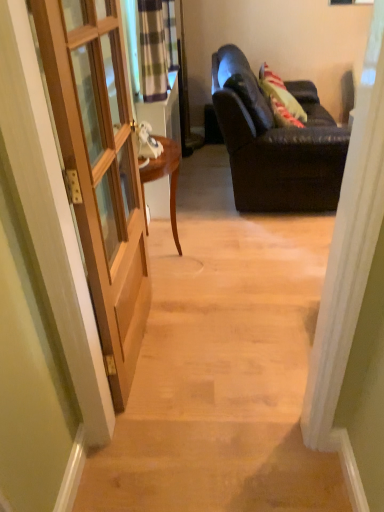
At what (x,y) coordinates should I click in order to perform the action: click on wooden door at left. Please return your answer as a coordinate pair (x, y). Image resolution: width=384 pixels, height=512 pixels. Looking at the image, I should click on (223, 376).

In order to face wooden door at left, should I rotate leftwards or rightwards?

Turn left by 8.842 degrees to look at wooden door at left.

At what (x,y) coordinates should I click in order to perform the action: click on wooden door at left. Please return your answer as a coordinate pair (x, y). The width and height of the screenshot is (384, 512). Looking at the image, I should click on (223, 376).

Is wooden door at left wider than dark brown leather couch at right?

Yes, wooden door at left is wider than dark brown leather couch at right.

What's the angular difference between wooden door at left and dark brown leather couch at right's facing directions?

wooden door at left and dark brown leather couch at right are facing 90.6 degrees away from each other.

Where is `stairwell in front of the dark brown leather couch at right`? The image size is (384, 512). stairwell in front of the dark brown leather couch at right is located at coordinates pos(223,376).

Considering the positions of objects wooden door at left and dark brown leather couch at right in the image provided, who is more to the left, wooden door at left or dark brown leather couch at right?

Positioned to the left is wooden door at left.

Can you confirm if dark brown leather couch at right is taller than wooden door at left?

No.

Consider the image. From a real-world perspective, is dark brown leather couch at right over wooden door at left?

No, from a real-world perspective, dark brown leather couch at right is not above wooden door at left.

Identify the location of door in front of the dark brown leather couch at right. The height and width of the screenshot is (512, 384). (100, 169).

What's the angular difference between dark brown leather couch at right and wooden door at left's facing directions?

There is a 1.76-degree angle between the facing directions of dark brown leather couch at right and wooden door at left.

Is wooden door at left behind wooden door at left?

Yes.

At what (x,y) coordinates should I click in order to perform the action: click on door to the left of wooden door at left. Please return your answer as a coordinate pair (x, y). Looking at the image, I should click on (100, 169).

From the image's perspective, is wooden door at left below wooden door at left?

Correct, wooden door at left appears lower than wooden door at left in the image.

Is plaid fabric curtain at upper left touching dark brown leather couch at right?

No, plaid fabric curtain at upper left is not touching dark brown leather couch at right.

Does plaid fabric curtain at upper left have a lesser height compared to dark brown leather couch at right?

Indeed, plaid fabric curtain at upper left has a lesser height compared to dark brown leather couch at right.

From the image's perspective, does plaid fabric curtain at upper left appear higher than dark brown leather couch at right?

Yes.

Considering the relative sizes of plaid fabric curtain at upper left and dark brown leather couch at right in the image provided, is plaid fabric curtain at upper left wider than dark brown leather couch at right?

In fact, plaid fabric curtain at upper left might be narrower than dark brown leather couch at right.

You are a GUI agent. You are given a task and a screenshot of the screen. Output one action in this format:
    pyautogui.click(x=<x>, y=<y>)
    Task: Click on the door on the left of the plaid fabric curtain at upper left
    
    Given the screenshot: What is the action you would take?
    [100, 169]

Is wooden door at left far away from plaid fabric curtain at upper left?

Yes, wooden door at left and plaid fabric curtain at upper left are quite far apart.

Can you confirm if wooden door at left is wider than plaid fabric curtain at upper left?

No, wooden door at left is not wider than plaid fabric curtain at upper left.

From a real-world perspective, between wooden door at left and plaid fabric curtain at upper left, who is vertically lower?

wooden door at left is physically lower.

Is point (311, 153) closer or farther from the camera than point (145, 53)?

Point (311, 153) is positioned farther from the camera compared to point (145, 53).

In the scene shown: Is dark brown leather couch at right facing towards plaid fabric curtain at upper left?

No, dark brown leather couch at right does not turn towards plaid fabric curtain at upper left.

Choose the correct answer: Is dark brown leather couch at right inside plaid fabric curtain at upper left or outside it?

dark brown leather couch at right is outside plaid fabric curtain at upper left.

Is wooden door at left taller than plaid fabric curtain at upper left?

No.

Considering the relative positions of wooden door at left and plaid fabric curtain at upper left in the image provided, is wooden door at left to the right of plaid fabric curtain at upper left from the viewer's perspective?

Correct, you'll find wooden door at left to the right of plaid fabric curtain at upper left.

From the image's perspective, is wooden door at left on plaid fabric curtain at upper left?

No, from the image's perspective, wooden door at left is not on top of plaid fabric curtain at upper left.

Do you think wooden door at left is within plaid fabric curtain at upper left, or outside of it?

wooden door at left lies outside plaid fabric curtain at upper left.

At what (x,y) coordinates should I click in order to perform the action: click on studio couch on the right of wooden door at left. Please return your answer as a coordinate pair (x, y). The height and width of the screenshot is (512, 384). Looking at the image, I should click on (276, 143).

Locate an element on the screen. door above the dark brown leather couch at right (from a real-world perspective) is located at coordinates (100, 169).

When comparing their distances from wooden door at left, does plaid fabric curtain at upper left or dark brown leather couch at right seem further?

Among the two, plaid fabric curtain at upper left is located further to wooden door at left.

Based on their spatial positions, is wooden door at left or wooden door at left further from plaid fabric curtain at upper left?

Among the two, wooden door at left is located further to plaid fabric curtain at upper left.

Which object lies further to the anchor point wooden door at left, plaid fabric curtain at upper left or wooden door at left?

plaid fabric curtain at upper left lies further to wooden door at left than the other object.

Estimate the real-world distances between objects in this image. Which object is further from dark brown leather couch at right, plaid fabric curtain at upper left or wooden door at left?

wooden door at left is positioned further to the anchor dark brown leather couch at right.

Based on their spatial positions, is dark brown leather couch at right or plaid fabric curtain at upper left closer to wooden door at left?

dark brown leather couch at right is closer to wooden door at left.

Which object lies further to the anchor point dark brown leather couch at right, wooden door at left or plaid fabric curtain at upper left?

wooden door at left is further to dark brown leather couch at right.

In the scene shown: Considering their positions, is dark brown leather couch at right positioned further to wooden door at left than wooden door at left?

dark brown leather couch at right is further to wooden door at left.

Estimate the real-world distances between objects in this image. Which object is further from wooden door at left, wooden door at left or dark brown leather couch at right?

Among the two, dark brown leather couch at right is located further to wooden door at left.

Identify the location of studio couch between plaid fabric curtain at upper left and wooden door at left from top to bottom. The image size is (384, 512). (276, 143).

Image resolution: width=384 pixels, height=512 pixels. Find the location of `curtain between wooden door at left and dark brown leather couch at right along the z-axis`. curtain between wooden door at left and dark brown leather couch at right along the z-axis is located at coordinates (156, 47).

Locate an element on the screen. The height and width of the screenshot is (512, 384). stairwell located between wooden door at left and plaid fabric curtain at upper left in the depth direction is located at coordinates (223, 376).

Find the location of a particular element. The height and width of the screenshot is (512, 384). stairwell positioned between wooden door at left and dark brown leather couch at right from near to far is located at coordinates (223, 376).